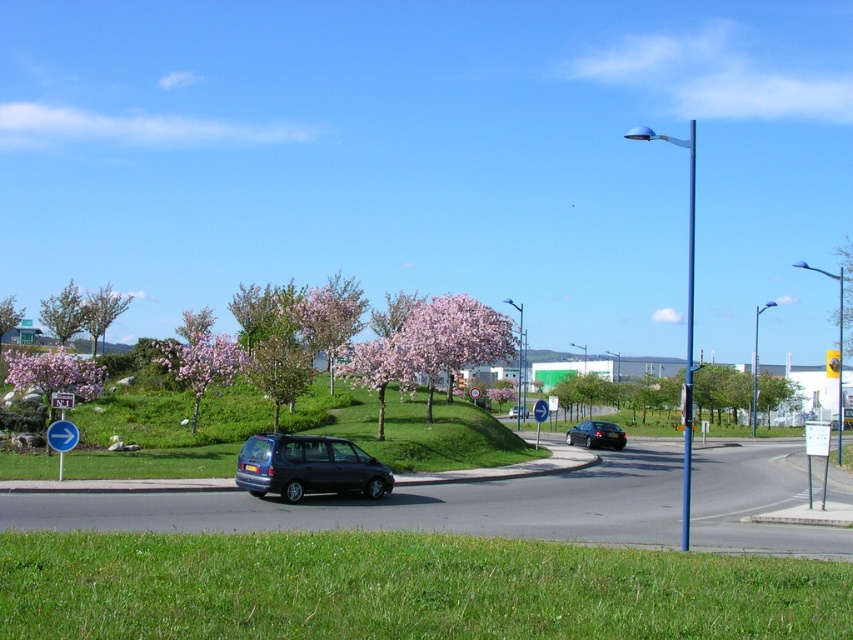
Can you confirm if metallic blue minivan at center is positioned above green leafy tree at center?

Indeed, metallic blue minivan at center is positioned over green leafy tree at center.

This screenshot has height=640, width=853. What do you see at coordinates (308, 467) in the screenshot?
I see `metallic blue minivan at center` at bounding box center [308, 467].

The width and height of the screenshot is (853, 640). What do you see at coordinates (308, 467) in the screenshot? I see `metallic blue minivan at center` at bounding box center [308, 467].

Locate an element on the screen. metallic blue minivan at center is located at coordinates (308, 467).

Can you confirm if pink blossoming tree at left is positioned below pink blossoming tree at center?

Incorrect, pink blossoming tree at left is not positioned below pink blossoming tree at center.

Which is above, pink blossoming tree at left or pink blossoming tree at center?

pink blossoming tree at left

Who is more forward, (64, 326) or (0, 312)?

Point (64, 326) is more forward.

Image resolution: width=853 pixels, height=640 pixels. Identify the location of pink blossoming tree at left. (62, 312).

Can you confirm if pink blossoms at center is wider than shiny black sedan at center?

Yes, pink blossoms at center is wider than shiny black sedan at center.

Who is shorter, pink blossoms at center or shiny black sedan at center?

shiny black sedan at center

The height and width of the screenshot is (640, 853). Describe the element at coordinates (453, 339) in the screenshot. I see `pink blossoms at center` at that location.

I want to click on pink blossoms at center, so click(453, 339).